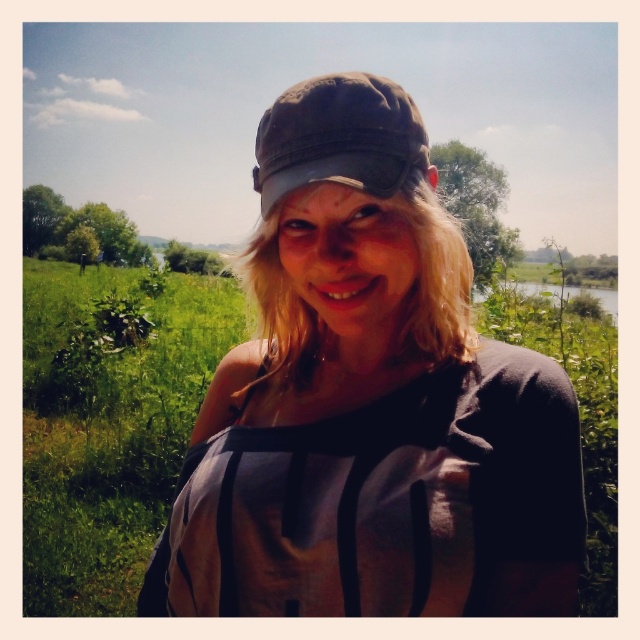
Consider the image. Does matte gray cap at center have a smaller size compared to dark brown fabric baseball cap at center?

Correct, matte gray cap at center occupies less space than dark brown fabric baseball cap at center.

Can you confirm if matte gray cap at center is taller than dark brown fabric baseball cap at center?

Yes, matte gray cap at center is taller than dark brown fabric baseball cap at center.

Between point (291, 248) and point (364, 100), which one is positioned behind?

The point (291, 248) is more distant.

At what (x,y) coordinates should I click in order to perform the action: click on matte gray cap at center. Please return your answer as a coordinate pair (x, y). The image size is (640, 640). Looking at the image, I should click on (369, 403).